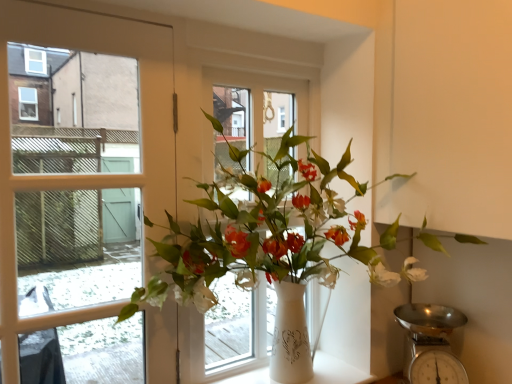
Question: Does metallic silver scale at lower right have a greater width compared to white glossy vase at center?

Choices:
 (A) yes
 (B) no

Answer: (B)

Question: Does metallic silver scale at lower right appear on the right side of white glossy vase at center?

Choices:
 (A) no
 (B) yes

Answer: (B)

Question: Is metallic silver scale at lower right oriented towards white glossy vase at center?

Choices:
 (A) yes
 (B) no

Answer: (B)

Question: Does metallic silver scale at lower right have a larger size compared to white glossy vase at center?

Choices:
 (A) no
 (B) yes

Answer: (A)

Question: From the image's perspective, is metallic silver scale at lower right located beneath white glossy vase at center?

Choices:
 (A) no
 (B) yes

Answer: (B)

Question: Is metallic silver scale at lower right wider or thinner than white plastic window frame at center?

Choices:
 (A) thin
 (B) wide

Answer: (B)

Question: Would you say metallic silver scale at lower right is to the left or to the right of white plastic window frame at center in the picture?

Choices:
 (A) left
 (B) right

Answer: (B)

Question: From a real-world perspective, relative to white plastic window frame at center, is metallic silver scale at lower right vertically above or below?

Choices:
 (A) below
 (B) above

Answer: (A)

Question: Considering the positions of metallic silver scale at lower right and white plastic window frame at center in the image, is metallic silver scale at lower right taller or shorter than white plastic window frame at center?

Choices:
 (A) short
 (B) tall

Answer: (A)

Question: Based on their positions, is white glossy vase at center located to the left or right of metallic silver scale at lower right?

Choices:
 (A) left
 (B) right

Answer: (A)

Question: Considering their positions, is white glossy vase at center located in front of or behind metallic silver scale at lower right?

Choices:
 (A) behind
 (B) front

Answer: (B)

Question: From the image's perspective, relative to metallic silver scale at lower right, is white glossy vase at center above or below?

Choices:
 (A) below
 (B) above

Answer: (B)

Question: From a real-world perspective, is white glossy vase at center physically located above or below metallic silver scale at lower right?

Choices:
 (A) above
 (B) below

Answer: (A)

Question: From a real-world perspective, is white ceramic vase at center physically located above or below white glossy vase at center?

Choices:
 (A) below
 (B) above

Answer: (A)

Question: Based on their sizes in the image, would you say white ceramic vase at center is bigger or smaller than white glossy vase at center?

Choices:
 (A) big
 (B) small

Answer: (B)